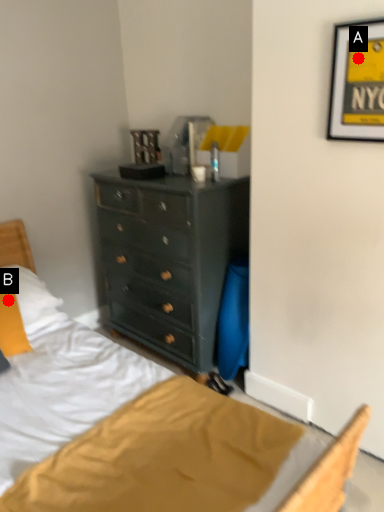
Question: Two points are circled on the image, labeled by A and B beside each circle. Which point is closer to the camera?

Choices:
 (A) A is closer
 (B) B is closer

Answer: (A)